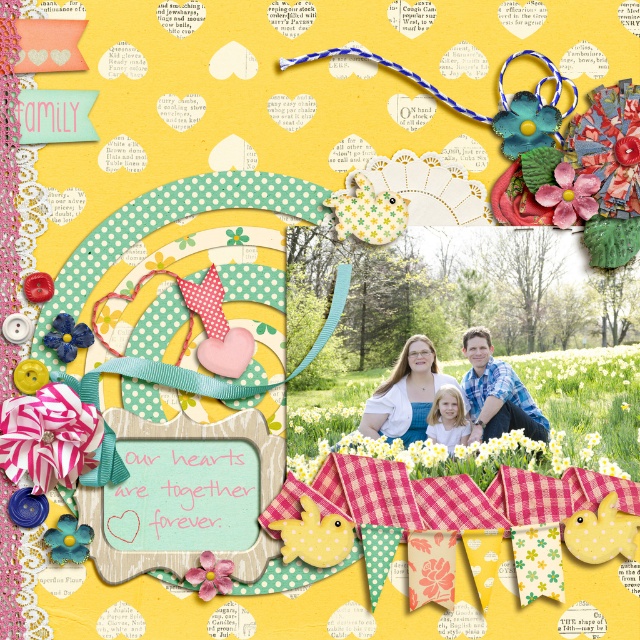
You are holding a scrapbook and looking at the central family photo. There is a point marked at coordinates (474, 339) on the page. If you want to place a sticker exactly 1.5 meters away from this point towards the viewer, where would it be placed?

The point at coordinates (474, 339) is 1.38 meters from the viewer. Placing a sticker 1.5 meters away from this point towards the viewer would require moving it closer to the viewer by 0.12 meters, but since the original point is already 1.38 meters away, the new position would be 1.38m minus 1.5m, resulting in a negative distance which isn not possible. Therefore, it is not possible to place the sticker 1.5 meters in front of the point as it would be behind the viewer.

You are designing a scrapbook layout and want to place a sticker between the two points, point (404, 397) and point (561, 173). Which point should the sticker be closer to in order to maintain depth perception?

The sticker should be placed closer to point (561, 173) because point (404, 397) is further to the viewer, so positioning the sticker near the closer point maintains depth perception.

You are designing a scrapbook layout and have placed two decorative stickers at coordinates point (x=516, y=436) and point (x=38, y=426). Which sticker is closer to the viewer?

Point (x=516, y=436) is further to the viewer than point (x=38, y=426), so the sticker at point (x=38, y=426) is closer to the viewer.